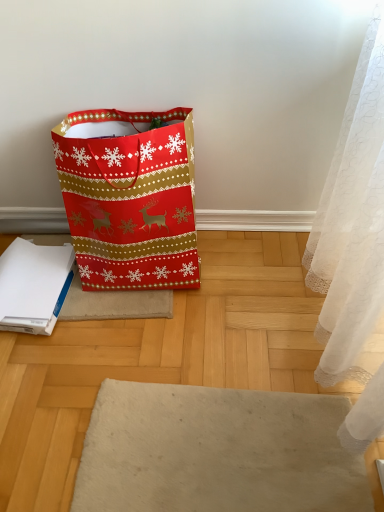
Question: In terms of size, does shiny paper bag at left appear bigger or smaller than white paper notebook at lower left?

Choices:
 (A) big
 (B) small

Answer: (A)

Question: In terms of height, does shiny paper bag at left look taller or shorter compared to white paper notebook at lower left?

Choices:
 (A) tall
 (B) short

Answer: (A)

Question: In the image, is shiny paper bag at left positioned in front of or behind white paper notebook at lower left?

Choices:
 (A) front
 (B) behind

Answer: (A)

Question: Would you say white paper notebook at lower left is to the left or to the right of shiny paper bag at left in the picture?

Choices:
 (A) left
 (B) right

Answer: (A)

Question: From the image's perspective, is white paper notebook at lower left located above or below shiny paper bag at left?

Choices:
 (A) below
 (B) above

Answer: (A)

Question: Is white paper notebook at lower left bigger or smaller than shiny paper bag at left?

Choices:
 (A) small
 (B) big

Answer: (A)

Question: In terms of height, does white paper notebook at lower left look taller or shorter compared to shiny paper bag at left?

Choices:
 (A) short
 (B) tall

Answer: (A)